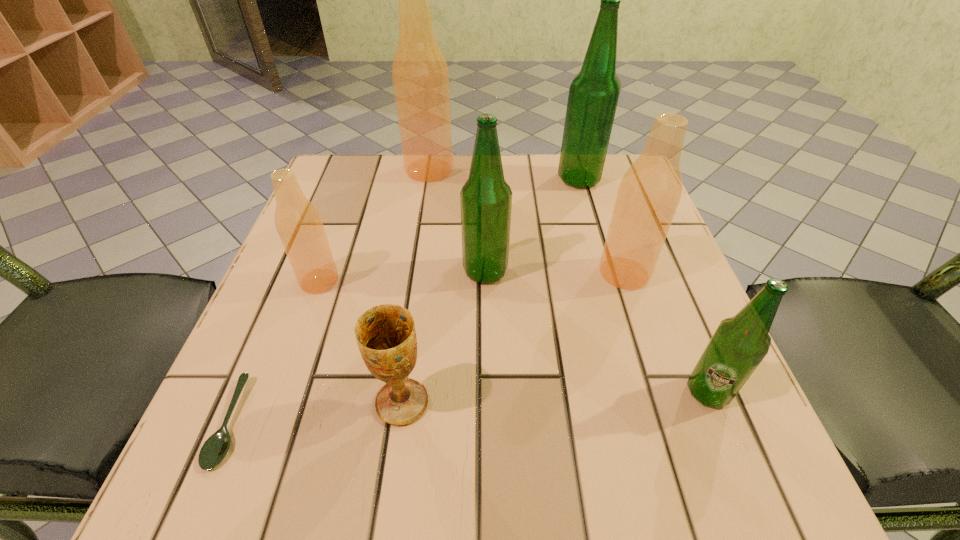
Identify the location of the farthest green beer bottle. This screenshot has width=960, height=540. (593, 96).

Locate an element on the screen. This screenshot has height=540, width=960. the biggest green beer bottle is located at coordinates (593, 96).

Find the location of a particular element. the fifth beer bottle from right to left is located at coordinates (420, 75).

The height and width of the screenshot is (540, 960). I want to click on the farthest tan beer bottle, so click(420, 75).

Where is `the second farthest green beer bottle`? the second farthest green beer bottle is located at coordinates (486, 198).

Identify the location of the third beer bottle from left to right. (486, 198).

You are a GUI agent. You are given a task and a screenshot of the screen. Output one action in this format:
    pyautogui.click(x=<x>, y=<y>)
    Task: Click on the rightmost tan beer bottle
    The height and width of the screenshot is (540, 960).
    Given the screenshot: What is the action you would take?
    pyautogui.click(x=649, y=193)

Locate an element on the screen. Image resolution: width=960 pixels, height=540 pixels. the smallest tan beer bottle is located at coordinates (299, 225).

Locate an element on the screen. Image resolution: width=960 pixels, height=540 pixels. the leftmost tan beer bottle is located at coordinates (x=299, y=225).

You are a GUI agent. You are given a task and a screenshot of the screen. Output one action in this format:
    pyautogui.click(x=<x>, y=<y>)
    Task: Click on the smallest green beer bottle
    This screenshot has height=540, width=960.
    Given the screenshot: What is the action you would take?
    739,344